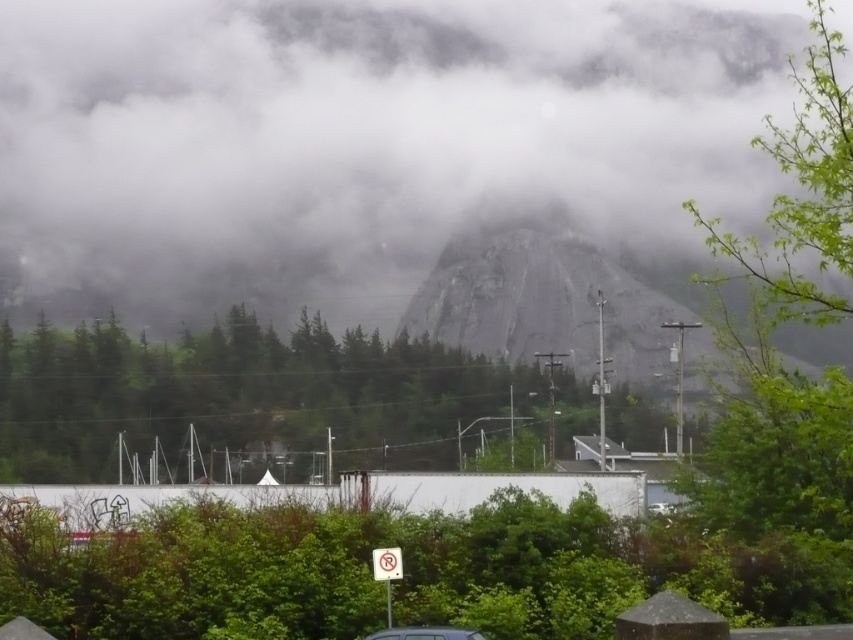
Question: Is white foggy mountain at center closer to camera compared to green leafy tree at center?

Choices:
 (A) yes
 (B) no

Answer: (B)

Question: Which point is farther to the camera?

Choices:
 (A) green leafy tree at center
 (B) metallic silver car at lower center
 (C) white foggy mountain at center
 (D) green leafy tree at right

Answer: (C)

Question: Is green leafy tree at center to the left of rugged stone mountain at center from the viewer's perspective?

Choices:
 (A) yes
 (B) no

Answer: (A)

Question: Based on their relative distances, which object is nearer to the white foggy mountain at center?

Choices:
 (A) metallic silver car at lower center
 (B) rugged stone mountain at center
 (C) green leafy tree at center

Answer: (B)

Question: Which of the following is the farthest from the observer?

Choices:
 (A) (73, 301)
 (B) (373, 634)
 (C) (792, 611)
 (D) (467, 314)

Answer: (A)

Question: Observing the image, what is the correct spatial positioning of green leafy tree at center in reference to rugged stone mountain at center?

Choices:
 (A) left
 (B) right

Answer: (A)